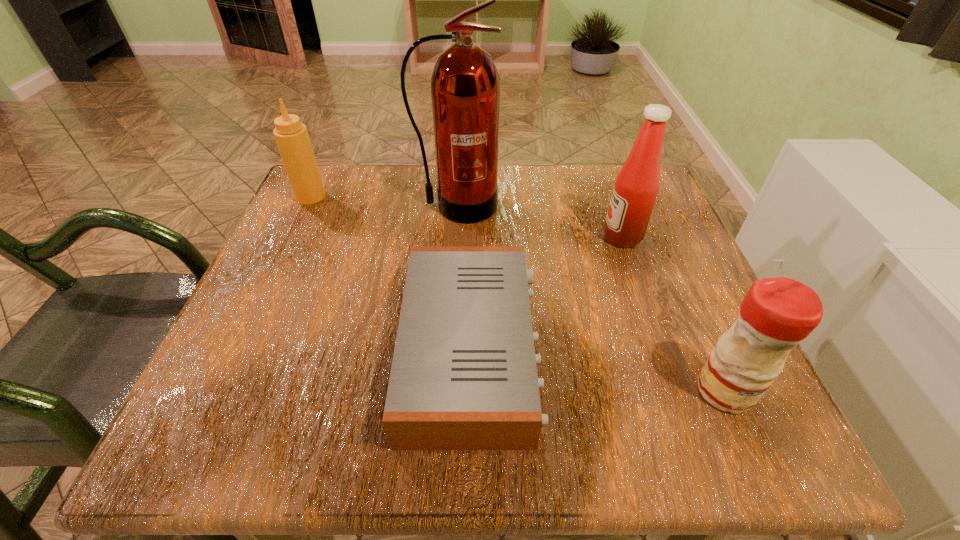
Locate an element on the screen. This screenshot has width=960, height=540. object at the near right corner is located at coordinates (776, 314).

You are a GUI agent. You are given a task and a screenshot of the screen. Output one action in this format:
    pyautogui.click(x=<x>, y=<y>)
    Task: Click on the vacant space at the far edge of the desktop
    The image size is (960, 540).
    Given the screenshot: What is the action you would take?
    pyautogui.click(x=534, y=168)

In the image, there is a desktop. Identify the location of vacant space at the near edge. The height and width of the screenshot is (540, 960). (586, 421).

In the image, there is a desktop. Where is `vacant space at the left edge`? vacant space at the left edge is located at coordinates pyautogui.click(x=301, y=268).

Locate an element on the screen. The width and height of the screenshot is (960, 540). vacant space at the right edge of the desktop is located at coordinates (644, 264).

Image resolution: width=960 pixels, height=540 pixels. I want to click on free space at the far left corner of the desktop, so click(369, 177).

What are the coordinates of `blank area at the far right corner` in the screenshot? It's located at (668, 211).

In the image, there is a desktop. Where is `vacant space at the near right corner`? The image size is (960, 540). vacant space at the near right corner is located at coordinates (705, 404).

Where is `vacant space that's between the tallest object and the fourth shortest object`? Image resolution: width=960 pixels, height=540 pixels. vacant space that's between the tallest object and the fourth shortest object is located at coordinates (540, 221).

I want to click on free area in between the leftmost condiment and the tallest object, so click(x=384, y=201).